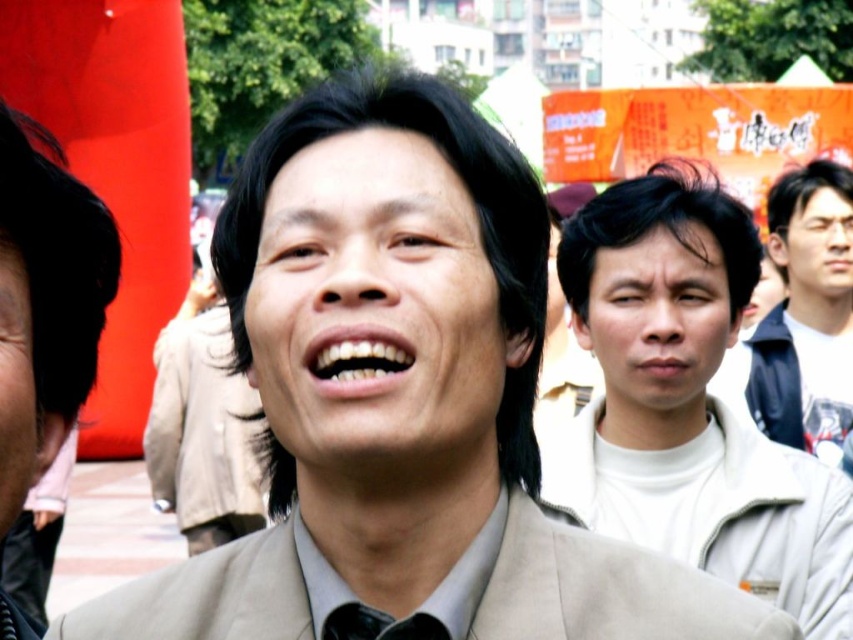
From the picture: Can you confirm if smooth beige face at center is positioned above matte black face at left?

Indeed, smooth beige face at center is positioned over matte black face at left.

Locate an element on the screen. Image resolution: width=853 pixels, height=640 pixels. smooth beige face at center is located at coordinates (376, 312).

This screenshot has height=640, width=853. Find the location of `smooth beige face at center`. smooth beige face at center is located at coordinates (376, 312).

Is beige fabric business suit at center shorter than smooth skin face at right?

Yes, beige fabric business suit at center is shorter than smooth skin face at right.

Who is positioned more to the right, beige fabric business suit at center or smooth skin face at right?

From the viewer's perspective, smooth skin face at right appears more on the right side.

Describe the element at coordinates (607, 589) in the screenshot. I see `beige fabric business suit at center` at that location.

Locate an element on the screen. This screenshot has width=853, height=640. beige fabric business suit at center is located at coordinates (607, 589).

Can you confirm if light beige suit at center is positioned to the right of smooth skin face at center?

Incorrect, light beige suit at center is not on the right side of smooth skin face at center.

From the picture: Measure the distance between light beige suit at center and camera.

They are 49.34 meters apart.

Is point (10, 176) closer to viewer compared to point (599, 307)?

Yes, it is.

I want to click on light beige suit at center, so click(x=45, y=304).